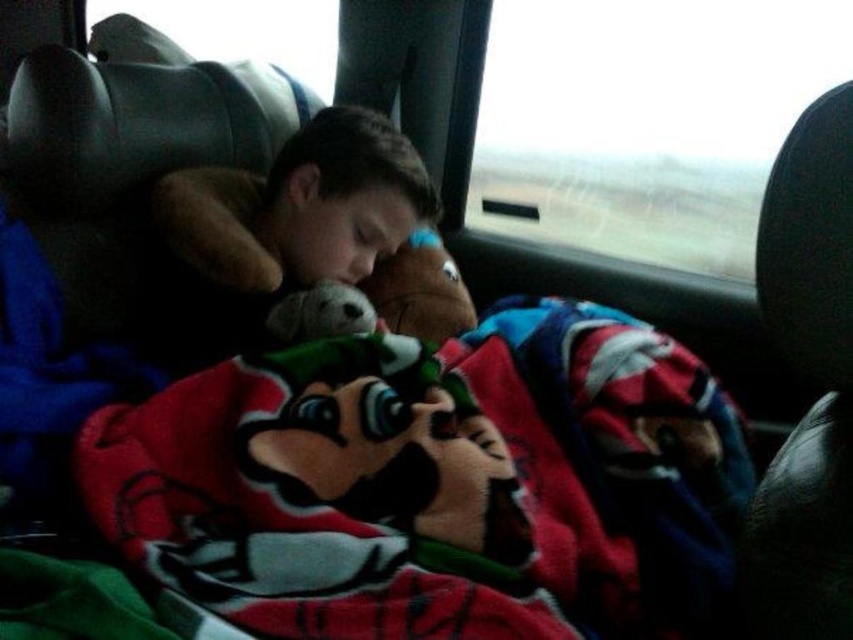
Can you confirm if red fleece blanket at center is smaller than soft plush toy at center?

Incorrect, red fleece blanket at center is not smaller in size than soft plush toy at center.

Is red fleece blanket at center bigger than soft plush toy at center?

Yes, red fleece blanket at center is bigger than soft plush toy at center.

Which is behind, point (300, 496) or point (341, 161)?

The point (341, 161) is more distant.

Find the location of a particular element. red fleece blanket at center is located at coordinates (437, 484).